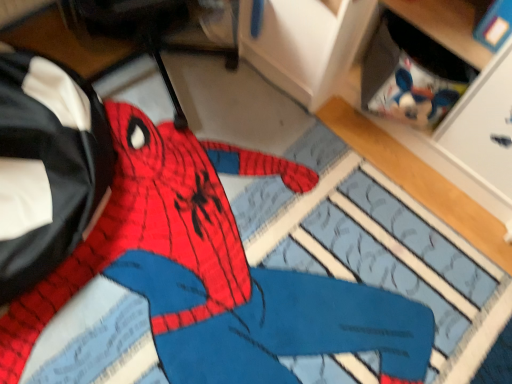
The image size is (512, 384). I want to click on free location to the right of black leather messenger bag at left, so click(218, 228).